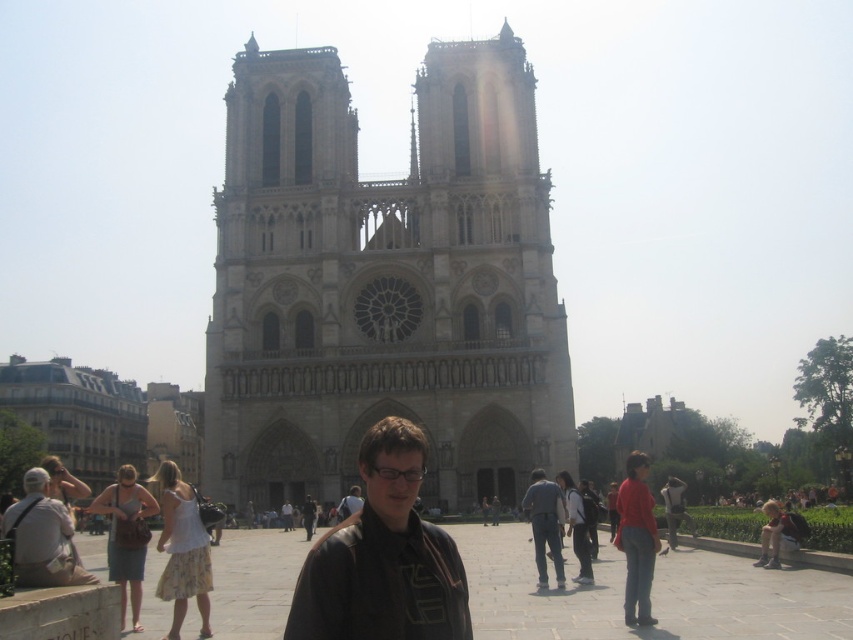
You are a photographer at the Notre Dame Cathedral plaza. You want to take a photo of the denim jeans at center and the matte brown jacket at center. Which object should you focus on first to ensure both are in the frame?

The denim jeans at center is in front of the matte brown jacket at center. Focus on the denim jeans at center first to ensure both are in the frame as the matte brown jacket at center will be behind it.

Looking at this image, you are standing in the plaza in front of Notre Dame Cathedral. You see a point at coordinates (383, 282). What does this point represent?

The point at coordinates (383, 282) indicates the gray stone cathedral at center.

You are a photographer planning to capture the gray stone cathedral at center and the light gray fabric bag at lower left in a single frame. Considering their sizes, which object should you focus on to ensure both are visible without cropping?

The gray stone cathedral at center is wider than the light gray fabric bag at lower left, so focusing on the cathedral will ensure both objects fit within the frame since it occupies more space.